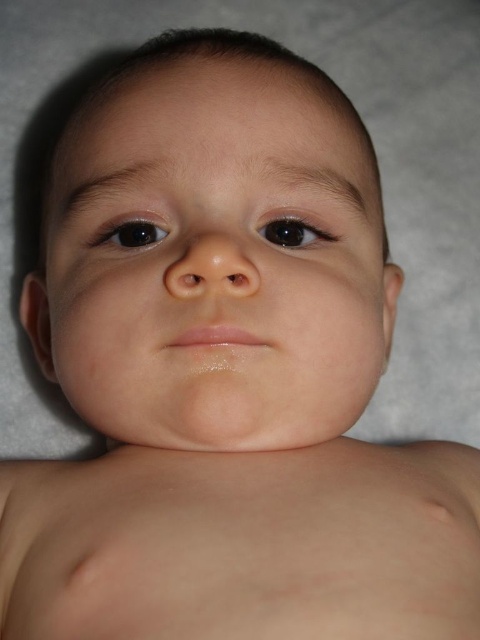
Question: Can you confirm if smooth skin face at center is thinner than black glossy eye at center?

Choices:
 (A) yes
 (B) no

Answer: (B)

Question: Which point is closer to the camera?

Choices:
 (A) black glossy eye at center
 (B) smooth skin face at center

Answer: (B)

Question: Does black glossy eye at center have a greater width compared to black glossy eye at upper left?

Choices:
 (A) no
 (B) yes

Answer: (B)

Question: Which of the following is the farthest from the observer?

Choices:
 (A) (276, 232)
 (B) (149, 230)
 (C) (238, 225)

Answer: (A)

Question: Which of the following is the farthest from the observer?

Choices:
 (A) [x=156, y=241]
 (B) [x=290, y=227]
 (C) [x=201, y=86]

Answer: (C)

Question: Can you confirm if smooth skin face at center is positioned to the left of black glossy eye at center?

Choices:
 (A) no
 (B) yes

Answer: (B)